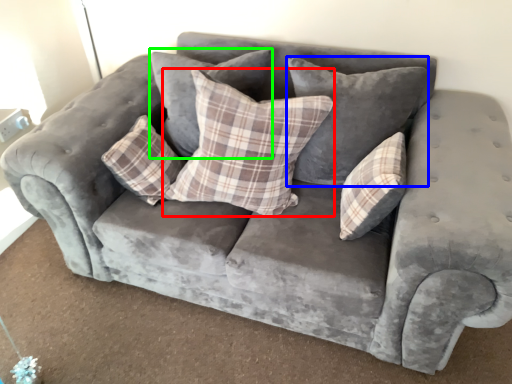
Question: Which is farther away from pillow (highlighted by a red box)? pillow (highlighted by a blue box) or pillow (highlighted by a green box)?

Choices:
 (A) pillow
 (B) pillow

Answer: (B)